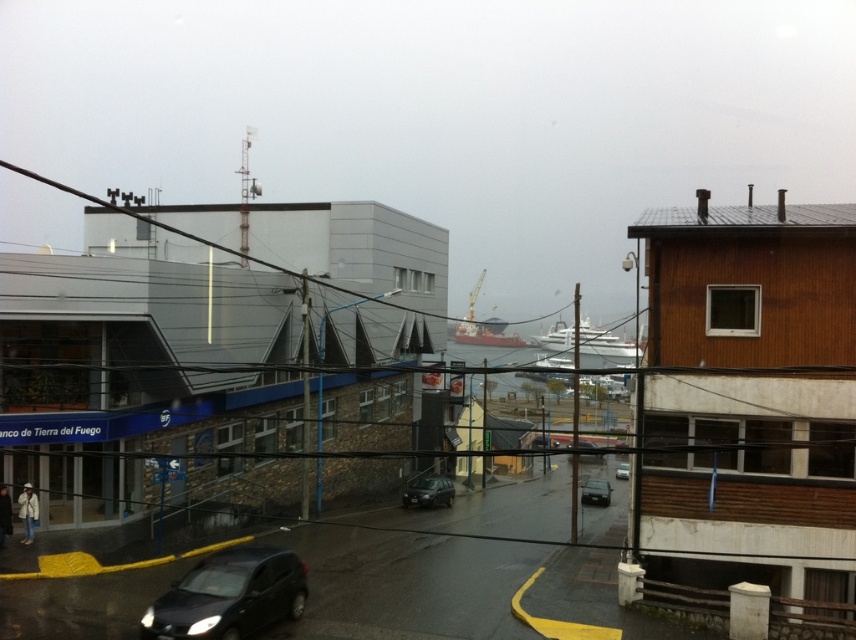
You are standing at the point with coordinates (595, 492) in the urban waterfront scene. What object is located exactly at your current position?

The shiny black sedan at center is located exactly at the point (595, 492).

You are a pedestrian standing on the sidewalk next to the shiny black sedan at center and the matte black car at center. Which car is closer to you?

The shiny black sedan at center is closer to you because it is positioned under the matte black car at center, meaning it is in front of it from your perspective.

You are a pedestrian standing on the sidewalk and see the shiny black car at center and the shiny black sedan at center. Which one is higher from the ground?

The shiny black car at center is higher from the ground than the shiny black sedan at center.